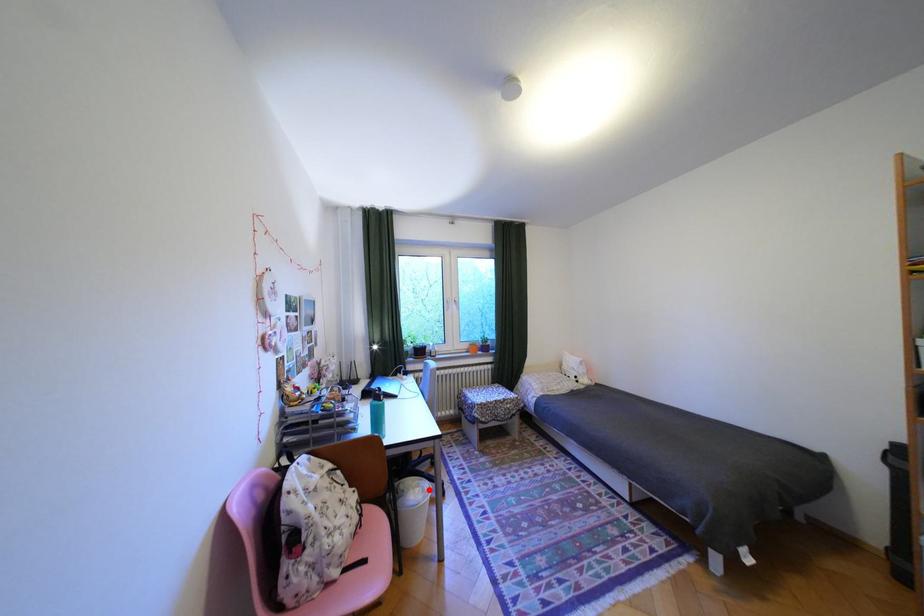
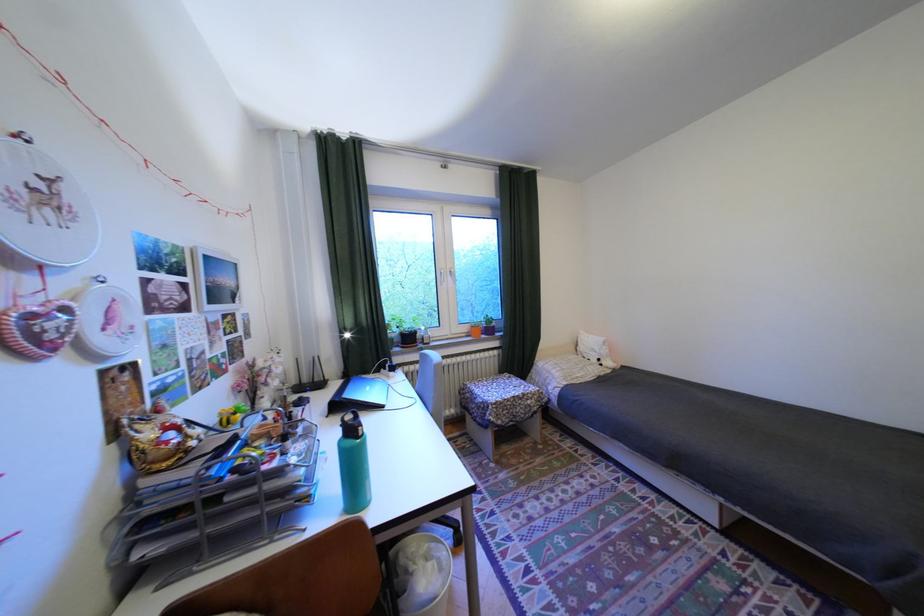
Question: I am providing you with two images of the same scene from different viewpoints. A red point is marked on the first image. At the location where the point appears in image 1, is it still visible in image 2?

Choices:
 (A) Yes
 (B) No

Answer: (A)